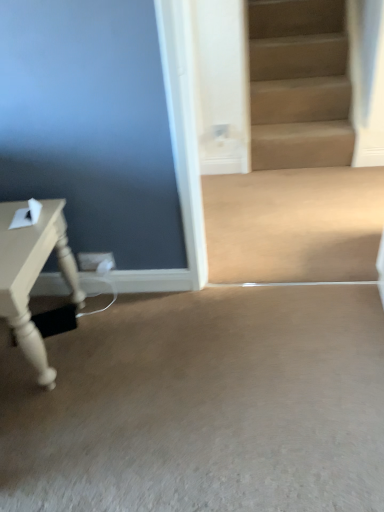
Locate an element on the screen. The image size is (384, 512). free space in front of matte white table at left is located at coordinates (52, 439).